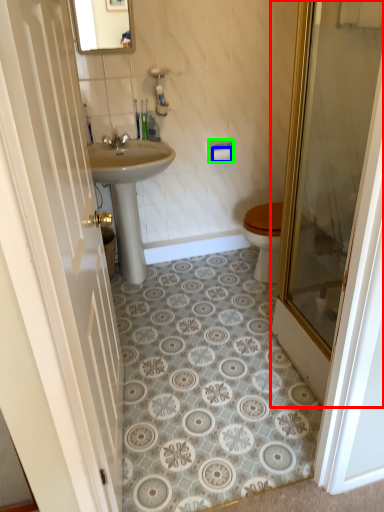
Question: Which object is the farthest from door (highlighted by a red box)? Choose among these: toilet paper (highlighted by a blue box) or towel bar (highlighted by a green box).

Choices:
 (A) toilet paper
 (B) towel bar

Answer: (A)